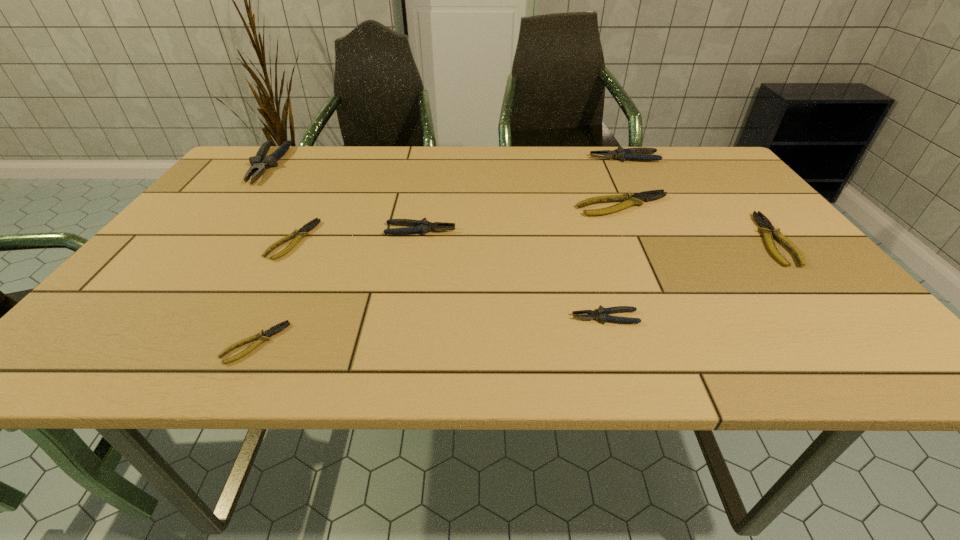
At what (x,y) coordinates should I click in order to perform the action: click on the tallest pliers. Please return your answer as a coordinate pair (x, y). Looking at the image, I should click on (259, 163).

The image size is (960, 540). What are the coordinates of `the leftmost object` in the screenshot? It's located at (259, 163).

Where is `the rightmost gray pliers`? The width and height of the screenshot is (960, 540). the rightmost gray pliers is located at coordinates (640, 153).

Locate an element on the screen. The width and height of the screenshot is (960, 540). the seventh shortest pliers is located at coordinates (640, 153).

The height and width of the screenshot is (540, 960). Identify the location of the second nearest gray pliers. (423, 226).

You are a GUI agent. You are given a task and a screenshot of the screen. Output one action in this format:
    pyautogui.click(x=<x>, y=<y>)
    Task: Click on the fifth object from right to left
    This screenshot has height=540, width=960.
    Given the screenshot: What is the action you would take?
    pyautogui.click(x=423, y=226)

Locate an element on the screen. The height and width of the screenshot is (540, 960). the second yellow pliers from right to left is located at coordinates (629, 199).

Find the location of a particular element. the second biggest yellow pliers is located at coordinates (766, 228).

Where is `the rightmost object`? This screenshot has width=960, height=540. the rightmost object is located at coordinates (766, 228).

I want to click on the second gray pliers from right to left, so click(601, 314).